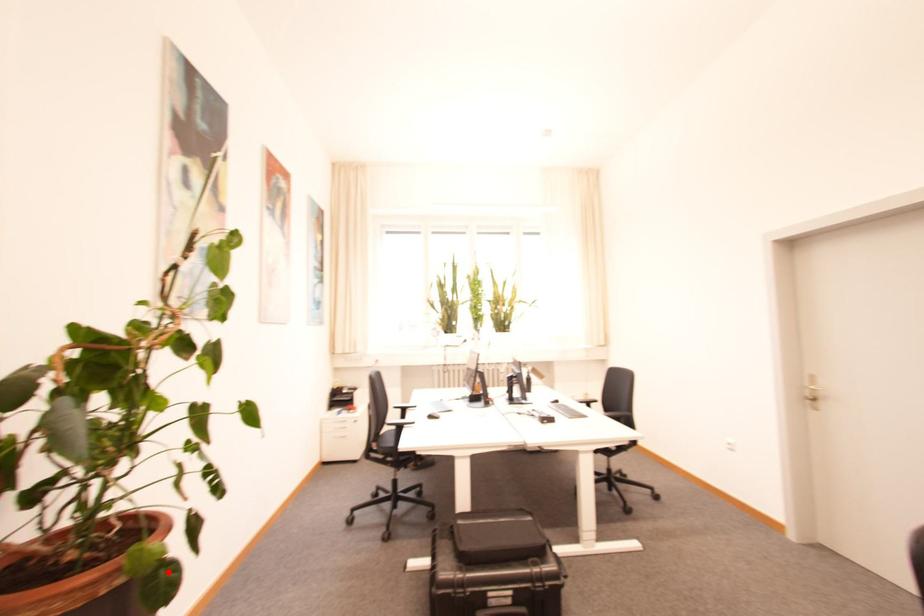
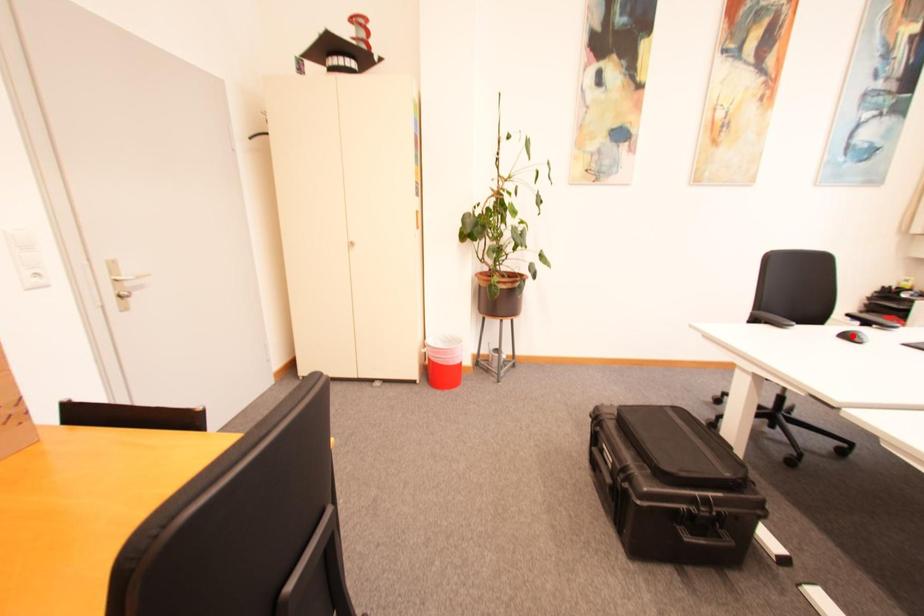
Looking at this image, I am providing you with two images of the same scene from different viewpoints. A red point is marked on the first image and another point is marked on the second image. Is the red point in image1 aligned with the point shown in image2?

No